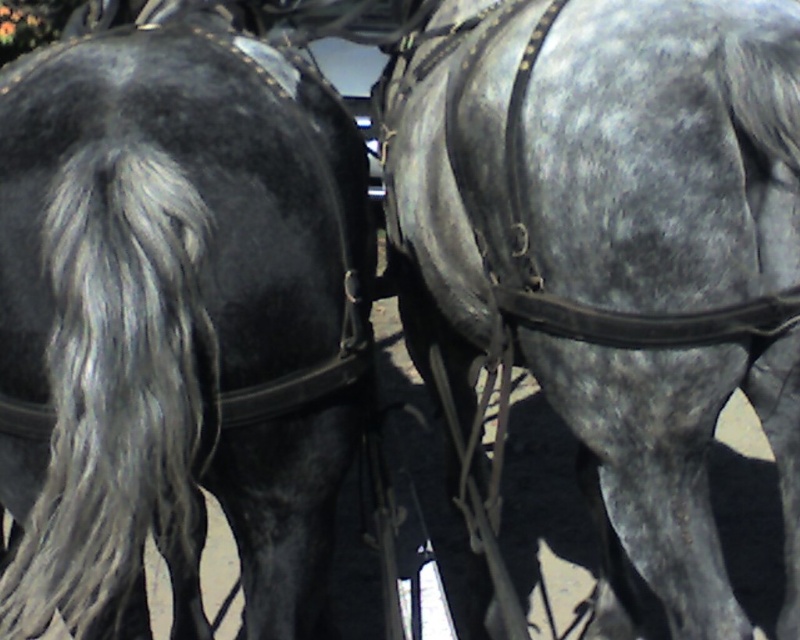
You are a photographer adjusting your camera to capture the shiny black horse at left. Your camera is currently focused at point [176,324]. Is the focus point correctly positioned to capture the shiny black horse at left?

The shiny black horse at left is located at point [176,324], so yes, the focus point at [176,324] is correctly positioned to capture the shiny black horse at left.

You are a horse trainer observing two horses in harnesses. You see the shiny black horse at left and the gray textured horse at center. Which horse is positioned to the left side of the other?

The shiny black horse at left is positioned to the left of the gray textured horse at center.

Looking at this image, you are a photographer taking a picture of two horses harnessed together. You notice two points on the horses, one at point (144,477) and another at point (616,180). Which point appears closer to your camera lens?

Point (144,477) is closer to the camera than point (616,180), so the point at (144,477) appears closer to your camera lens.